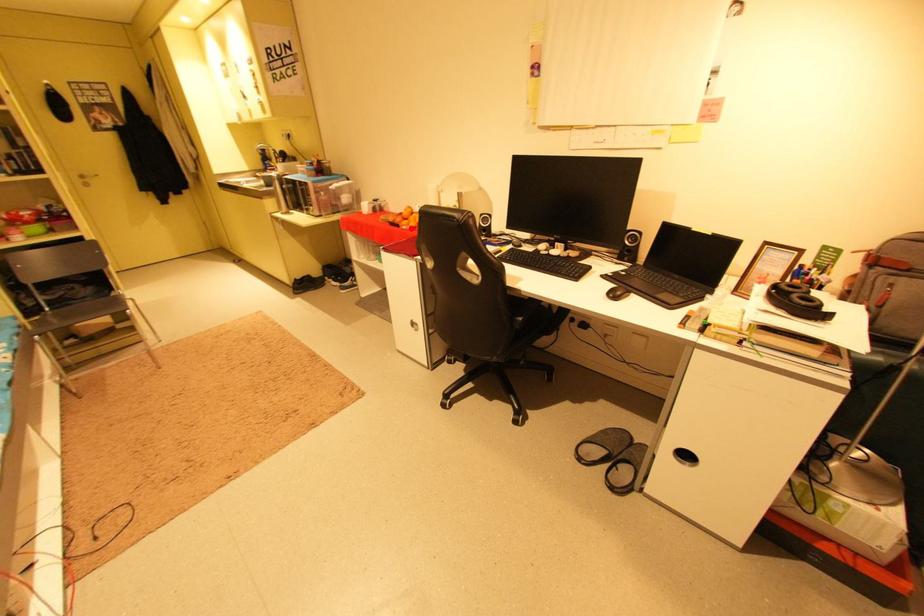
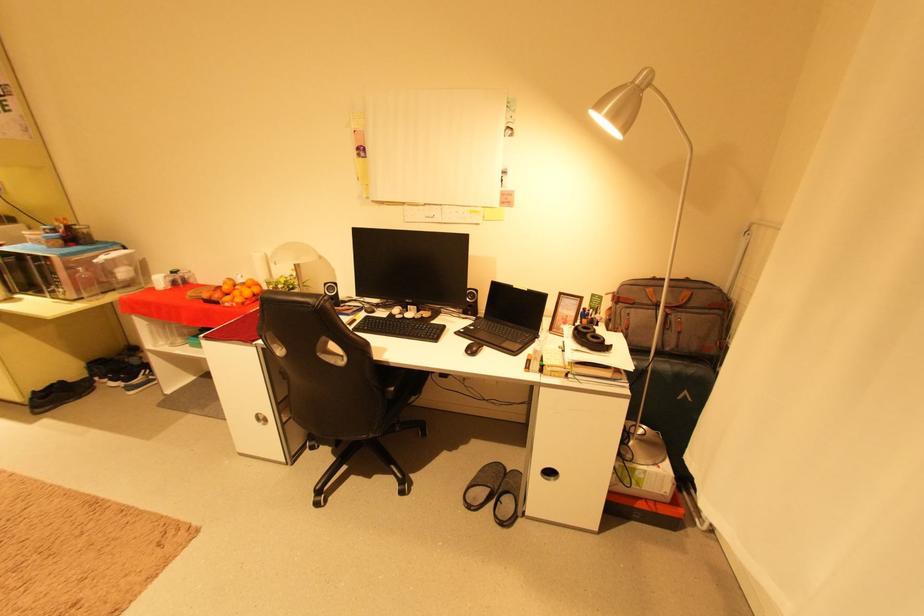
Question: A red point is marked in image1. In image2, is the corresponding 3D point closer to the camera or farther? Reply with the corresponding letter.

Choices:
 (A) The corresponding 3D point is closer.
 (B) The corresponding 3D point is farther.

Answer: (B)